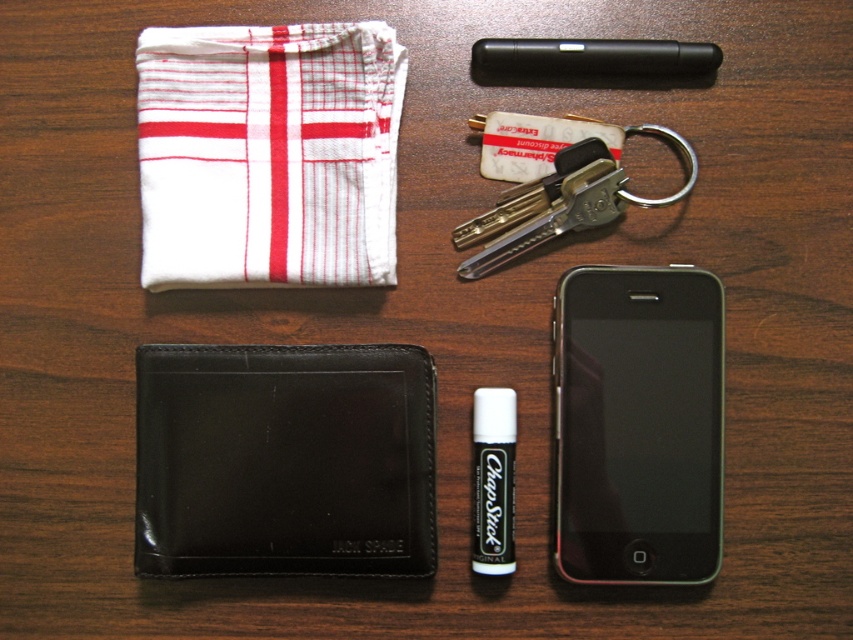
Question: Which object appears closest to the camera in this image?

Choices:
 (A) white woven cloth at upper left
 (B) metallic silver keys at upper center
 (C) black leather wallet at lower left
 (D) black matte smartphone at lower right

Answer: (A)

Question: Does white woven cloth at upper left come in front of black plastic pen at upper center?

Choices:
 (A) no
 (B) yes

Answer: (A)

Question: Does black matte smartphone at lower right have a smaller size compared to metallic silver keys at upper center?

Choices:
 (A) no
 (B) yes

Answer: (A)

Question: Which point is farther to the camera?

Choices:
 (A) black leather wallet at lower left
 (B) black plastic pen at upper center
 (C) black matte smartphone at lower right

Answer: (C)

Question: Is white woven cloth at upper left behind black matte smartphone at lower right?

Choices:
 (A) yes
 (B) no

Answer: (B)

Question: Which object is farther from the camera taking this photo?

Choices:
 (A) white woven cloth at upper left
 (B) metallic silver keys at upper center
 (C) black matte smartphone at lower right

Answer: (B)